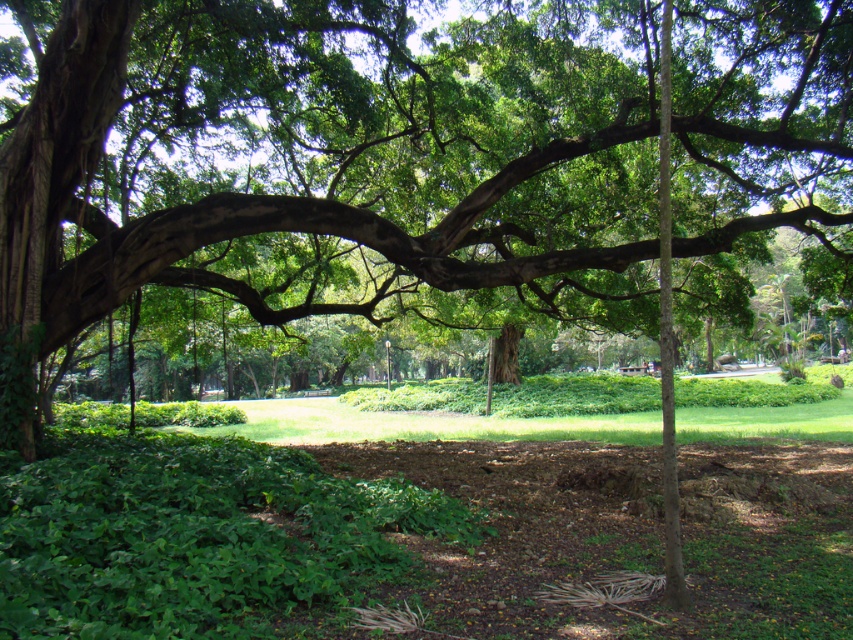
Question: Does green leafy tree at center appear under green leafy grass at center?

Choices:
 (A) no
 (B) yes

Answer: (A)

Question: Does green leafy tree at center appear under green leafy grass at center?

Choices:
 (A) yes
 (B) no

Answer: (B)

Question: Observing the image, what is the correct spatial positioning of green leafy tree at center in reference to green leafy grass at center?

Choices:
 (A) above
 (B) below

Answer: (A)

Question: Which of the following is the closest to the observer?

Choices:
 (A) green leafy grass at center
 (B) green leafy tree at center

Answer: (A)